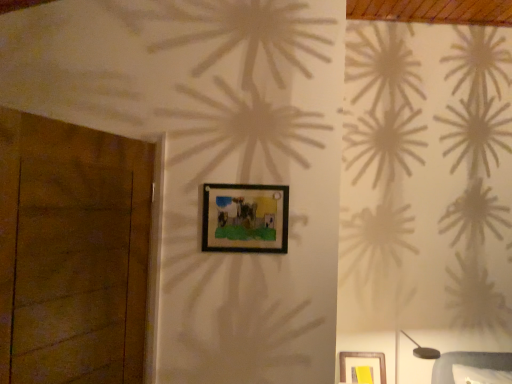
Question: Is metallic gray table lamp at lower right in contact with brown wooden door at left?

Choices:
 (A) no
 (B) yes

Answer: (A)

Question: Is metallic gray table lamp at lower right in front of brown wooden door at left?

Choices:
 (A) yes
 (B) no

Answer: (B)

Question: Can you confirm if metallic gray table lamp at lower right is taller than brown wooden door at left?

Choices:
 (A) no
 (B) yes

Answer: (A)

Question: Can you confirm if metallic gray table lamp at lower right is shorter than brown wooden door at left?

Choices:
 (A) yes
 (B) no

Answer: (A)

Question: Is metallic gray table lamp at lower right positioned with its back to brown wooden door at left?

Choices:
 (A) yes
 (B) no

Answer: (B)

Question: From the image's perspective, is black matte picture frame at center positioned above or below brown wooden door at left?

Choices:
 (A) below
 (B) above

Answer: (B)

Question: From a real-world perspective, is black matte picture frame at center positioned above or below brown wooden door at left?

Choices:
 (A) above
 (B) below

Answer: (A)

Question: Is point (274, 228) closer or farther from the camera than point (87, 266)?

Choices:
 (A) farther
 (B) closer

Answer: (A)

Question: From their relative heights in the image, would you say black matte picture frame at center is taller or shorter than brown wooden door at left?

Choices:
 (A) tall
 (B) short

Answer: (B)

Question: Is black matte picture frame at center inside the boundaries of metallic gray table lamp at lower right, or outside?

Choices:
 (A) outside
 (B) inside

Answer: (A)

Question: Considering the positions of black matte picture frame at center and metallic gray table lamp at lower right in the image, is black matte picture frame at center bigger or smaller than metallic gray table lamp at lower right?

Choices:
 (A) big
 (B) small

Answer: (B)

Question: From the image's perspective, relative to metallic gray table lamp at lower right, is black matte picture frame at center above or below?

Choices:
 (A) above
 (B) below

Answer: (A)

Question: Considering the positions of black matte picture frame at center and metallic gray table lamp at lower right in the image, is black matte picture frame at center taller or shorter than metallic gray table lamp at lower right?

Choices:
 (A) short
 (B) tall

Answer: (A)

Question: From the image's perspective, is metallic gray table lamp at lower right positioned above or below black matte picture frame at center?

Choices:
 (A) below
 (B) above

Answer: (A)

Question: Is metallic gray table lamp at lower right taller or shorter than black matte picture frame at center?

Choices:
 (A) tall
 (B) short

Answer: (A)